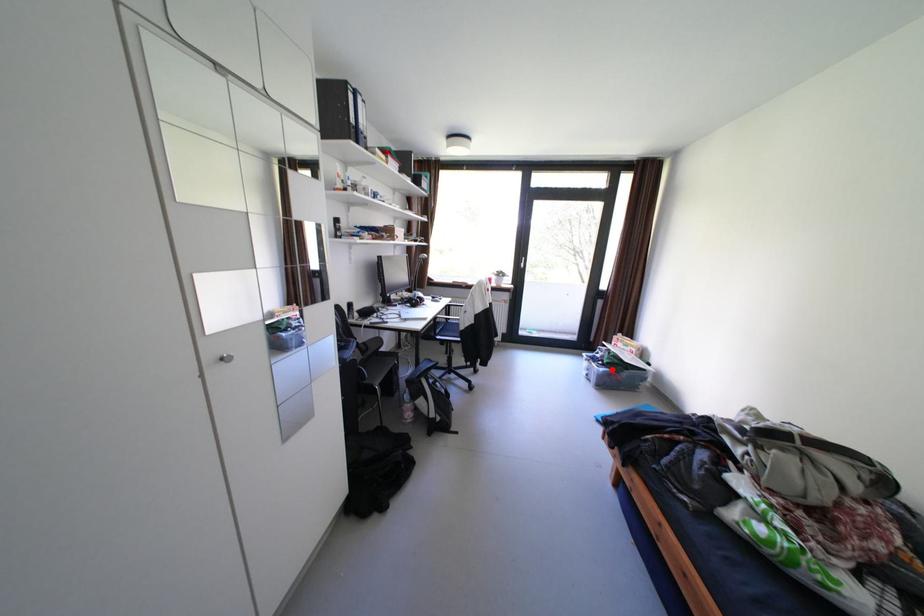
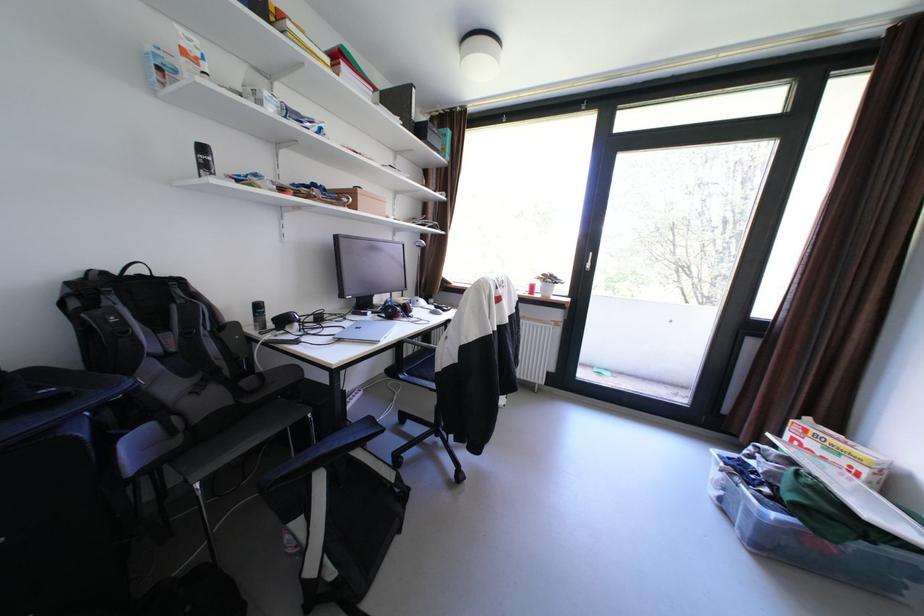
Locate, in the second image, the point that corresponds to the highlighted location in the first image.

(784, 516)